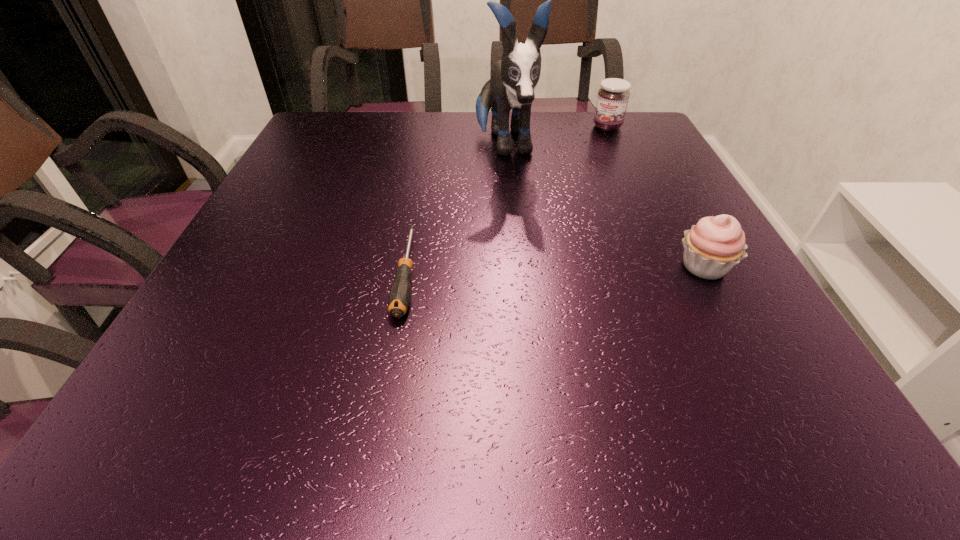
The image size is (960, 540). Identify the location of free point located 0.360m on the front label of the jam. (569, 200).

Locate an element on the screen. Image resolution: width=960 pixels, height=540 pixels. vacant area located on the front-facing side of the puppy is located at coordinates click(x=544, y=296).

Find the location of a particular element. vacant space located on the front-facing side of the puppy is located at coordinates [525, 230].

The width and height of the screenshot is (960, 540). What are the coordinates of `vacant space located 0.270m on the front-facing side of the puppy` in the screenshot? It's located at [x=531, y=249].

At what (x,y) coordinates should I click in order to perform the action: click on jam present at the far edge. Please return your answer as a coordinate pair (x, y). The image size is (960, 540). Looking at the image, I should click on (612, 100).

Locate an element on the screen. This screenshot has width=960, height=540. puppy present at the far edge is located at coordinates (514, 78).

Where is `cupcake at the right edge`? cupcake at the right edge is located at coordinates (714, 245).

Identify the location of jam that is positioned at the right edge. This screenshot has width=960, height=540. (612, 100).

At what (x,y) coordinates should I click in order to perform the action: click on object that is at the far right corner. Please return your answer as a coordinate pair (x, y). Looking at the image, I should click on pyautogui.click(x=612, y=100).

The image size is (960, 540). In order to click on vacant space at the far edge in this screenshot , I will do `click(544, 132)`.